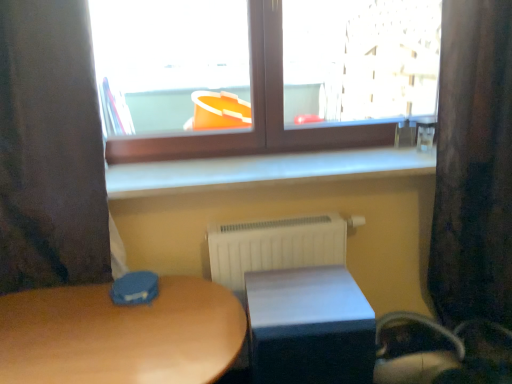
Question: Is velvet dark brown curtain at right, placed as the 1th curtain when sorted from right to left, to the right of dark fabric curtain at left, positioned as the 2th curtain in right-to-left order, from the viewer's perspective?

Choices:
 (A) yes
 (B) no

Answer: (A)

Question: From a real-world perspective, is velvet dark brown curtain at right, the 2th curtain viewed from the left, physically above dark fabric curtain at left, placed as the 1th curtain when sorted from left to right?

Choices:
 (A) no
 (B) yes

Answer: (A)

Question: Is velvet dark brown curtain at right, the 2th curtain viewed from the left, with dark fabric curtain at left, placed as the 1th curtain when sorted from left to right?

Choices:
 (A) yes
 (B) no

Answer: (B)

Question: Is velvet dark brown curtain at right, the 2th curtain viewed from the left, bigger than dark fabric curtain at left, positioned as the 2th curtain in right-to-left order?

Choices:
 (A) no
 (B) yes

Answer: (B)

Question: Is dark fabric curtain at left, positioned as the 2th curtain in right-to-left order, at the back of velvet dark brown curtain at right, placed as the 1th curtain when sorted from right to left?

Choices:
 (A) yes
 (B) no

Answer: (B)

Question: Looking at the image, does white matte table at lower center, placed as the 1th table when sorted from right to left, seem bigger or smaller compared to brown wooden window at upper center?

Choices:
 (A) small
 (B) big

Answer: (A)

Question: Considering the positions of white matte table at lower center, acting as the 2th table starting from the left, and brown wooden window at upper center in the image, is white matte table at lower center, acting as the 2th table starting from the left, taller or shorter than brown wooden window at upper center?

Choices:
 (A) short
 (B) tall

Answer: (A)

Question: From the image's perspective, relative to brown wooden window at upper center, is white matte table at lower center, acting as the 2th table starting from the left, above or below?

Choices:
 (A) above
 (B) below

Answer: (B)

Question: Considering the positions of point (331, 306) and point (400, 29), is point (331, 306) closer or farther from the camera than point (400, 29)?

Choices:
 (A) closer
 (B) farther

Answer: (A)

Question: In terms of width, does velvet dark brown curtain at right, the 2th curtain viewed from the left, look wider or thinner when compared to dark fabric curtain at left, positioned as the 2th curtain in right-to-left order?

Choices:
 (A) wide
 (B) thin

Answer: (A)

Question: In the image, is velvet dark brown curtain at right, the 2th curtain viewed from the left, on the left side or the right side of dark fabric curtain at left, placed as the 1th curtain when sorted from left to right?

Choices:
 (A) right
 (B) left

Answer: (A)

Question: Is velvet dark brown curtain at right, placed as the 1th curtain when sorted from right to left, bigger or smaller than dark fabric curtain at left, placed as the 1th curtain when sorted from left to right?

Choices:
 (A) big
 (B) small

Answer: (A)

Question: From a real-world perspective, relative to dark fabric curtain at left, positioned as the 2th curtain in right-to-left order, is velvet dark brown curtain at right, the 2th curtain viewed from the left, vertically above or below?

Choices:
 (A) below
 (B) above

Answer: (A)

Question: From the image's perspective, is white smooth window sill at center positioned above or below matte wooden table at center, the second table positioned from the right?

Choices:
 (A) above
 (B) below

Answer: (A)

Question: Looking at their shapes, would you say white smooth window sill at center is wider or thinner than matte wooden table at center, arranged as the 1th table when viewed from the left?

Choices:
 (A) wide
 (B) thin

Answer: (B)